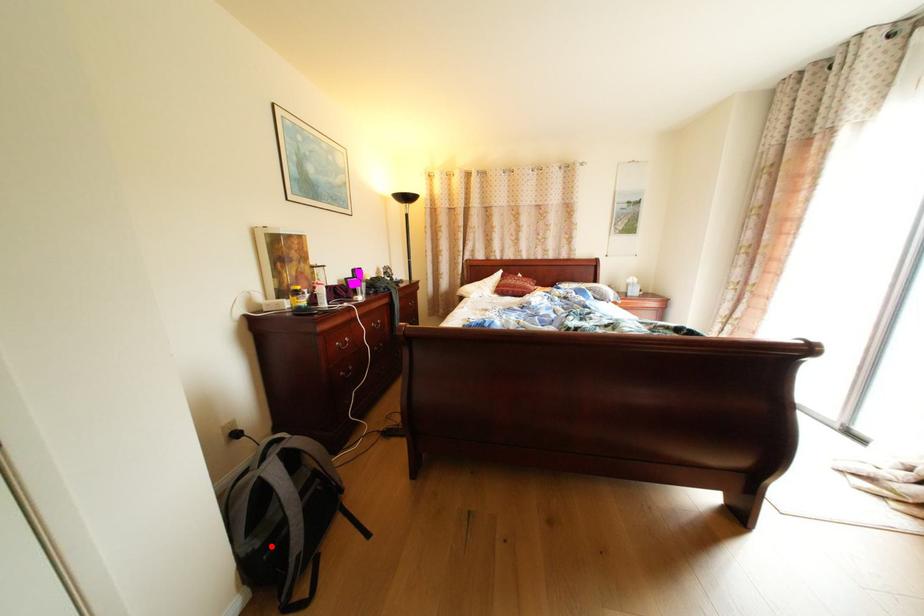
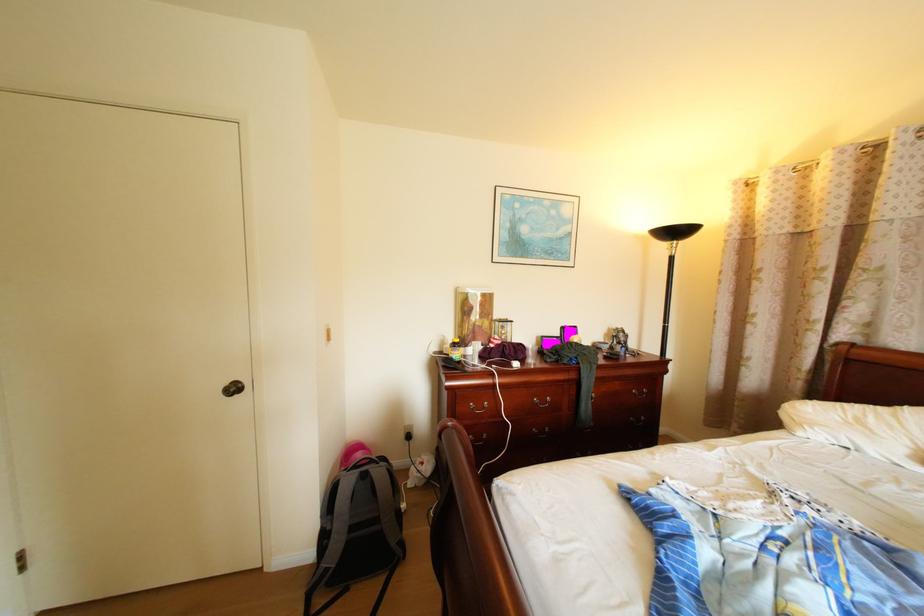
Question: I am providing you with two images of the same scene from different viewpoints. Image1 has a red point marked. In image2, the corresponding 3D location appears at what relative position? Reply with the corresponding letter.

Choices:
 (A) Closer
 (B) Farther

Answer: (B)